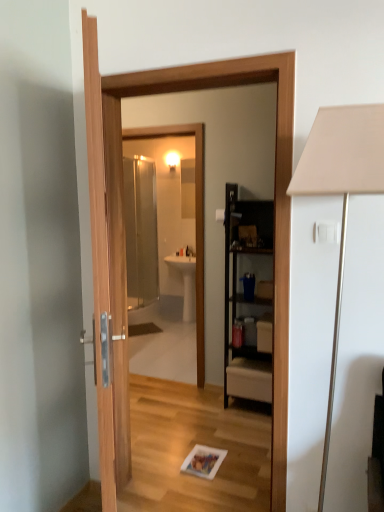
Question: Does white glossy sink at center have a lesser width compared to black wood cabinet at center?

Choices:
 (A) no
 (B) yes

Answer: (A)

Question: Is black wood cabinet at center located within white glossy sink at center?

Choices:
 (A) no
 (B) yes

Answer: (A)

Question: From a real-world perspective, is white glossy sink at center over black wood cabinet at center?

Choices:
 (A) no
 (B) yes

Answer: (A)

Question: Is white glossy sink at center far away from black wood cabinet at center?

Choices:
 (A) no
 (B) yes

Answer: (B)

Question: Considering the relative positions of white glossy sink at center and black wood cabinet at center in the image provided, is white glossy sink at center in front of black wood cabinet at center?

Choices:
 (A) yes
 (B) no

Answer: (B)

Question: Is white glossy sink at center wider than black wood cabinet at center?

Choices:
 (A) no
 (B) yes

Answer: (B)

Question: Is black wood cabinet at center facing towards white glossy sink at center?

Choices:
 (A) yes
 (B) no

Answer: (B)

Question: Is black wood cabinet at center smaller than white glossy sink at center?

Choices:
 (A) no
 (B) yes

Answer: (A)

Question: Is black wood cabinet at center facing away from white glossy sink at center?

Choices:
 (A) yes
 (B) no

Answer: (B)

Question: Is black wood cabinet at center outside white glossy sink at center?

Choices:
 (A) no
 (B) yes

Answer: (B)

Question: From a real-world perspective, is black wood cabinet at center physically below white glossy sink at center?

Choices:
 (A) no
 (B) yes

Answer: (A)

Question: Is black wood cabinet at center wider than white glossy sink at center?

Choices:
 (A) no
 (B) yes

Answer: (A)

Question: Is black wood cabinet at center not close to white matte table lamp at right?

Choices:
 (A) no
 (B) yes

Answer: (B)